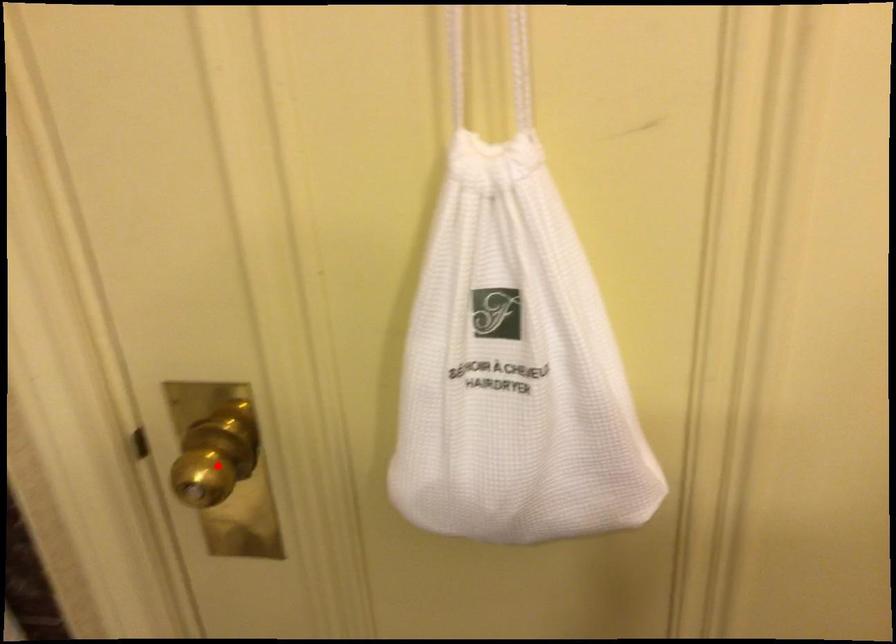
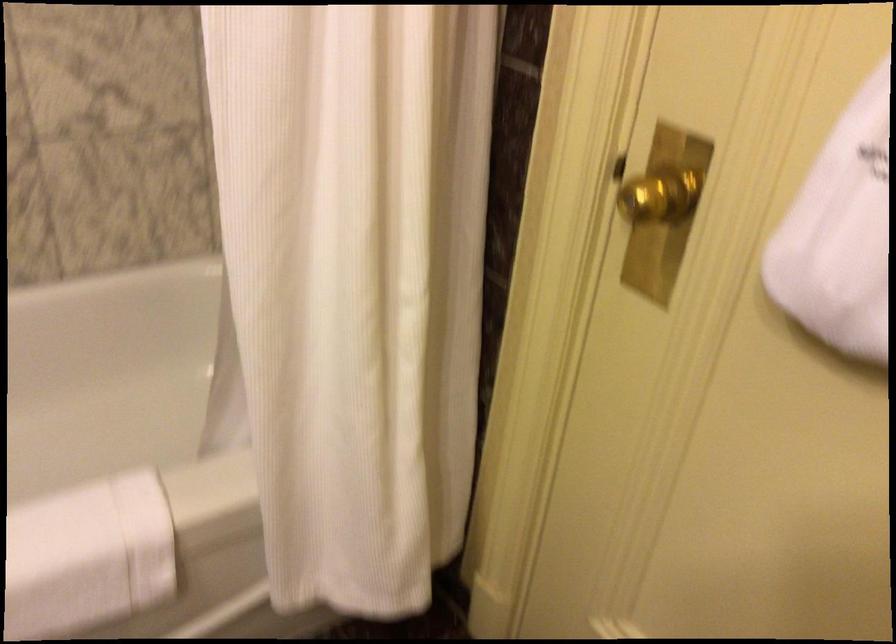
Locate, in the second image, the point that corresponds to the highlighted location in the first image.

(657, 194)